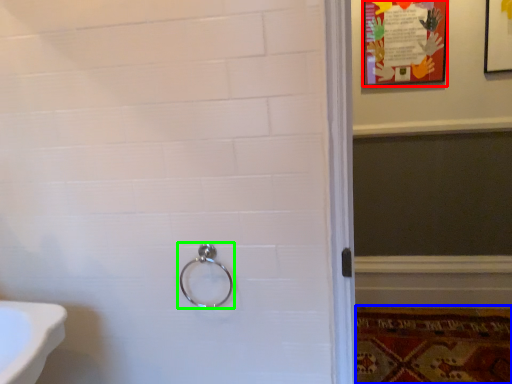
Question: Which is nearer to the poster page (highlighted by a red box)? mat (highlighted by a blue box) or door handle (highlighted by a green box).

Choices:
 (A) mat
 (B) door handle

Answer: (A)